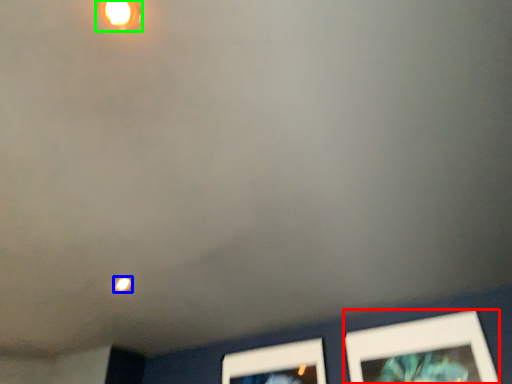
Question: Based on their relative distances, which object is nearer to picture frame (highlighted by a red box)? Choose from light (highlighted by a blue box) and light fixture (highlighted by a green box).

Choices:
 (A) light
 (B) light fixture

Answer: (A)